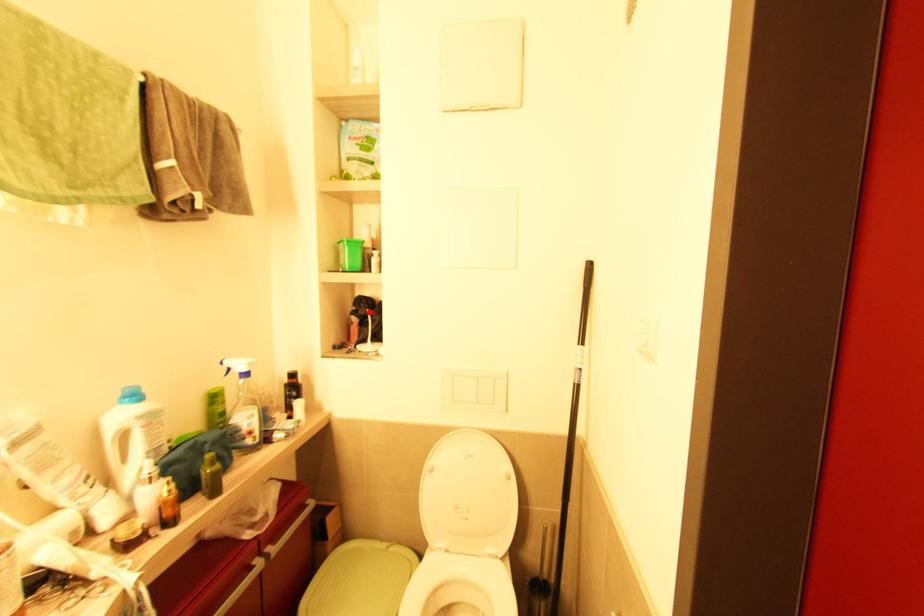
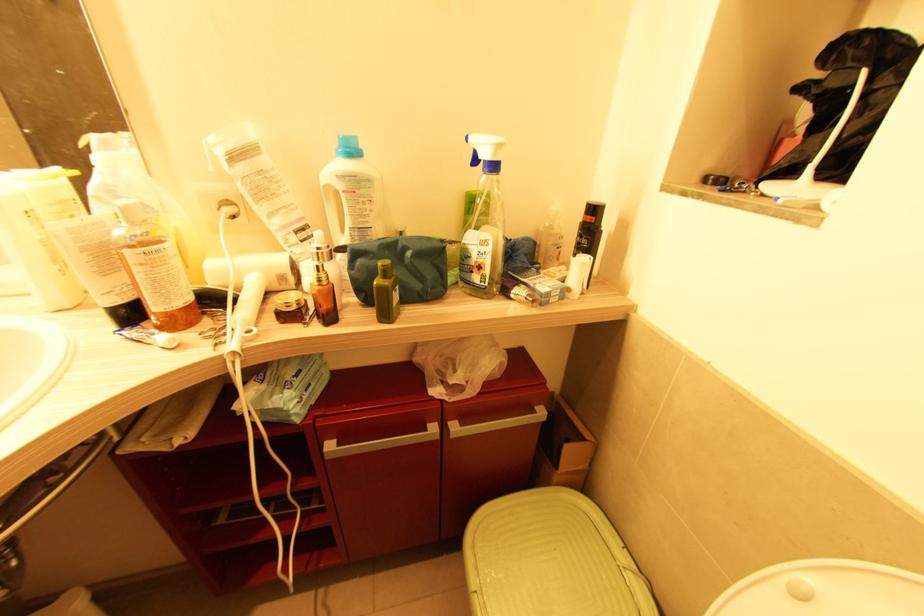
Locate, in the second image, the point that corresponds to the highlighted location in the first image.

(867, 73)